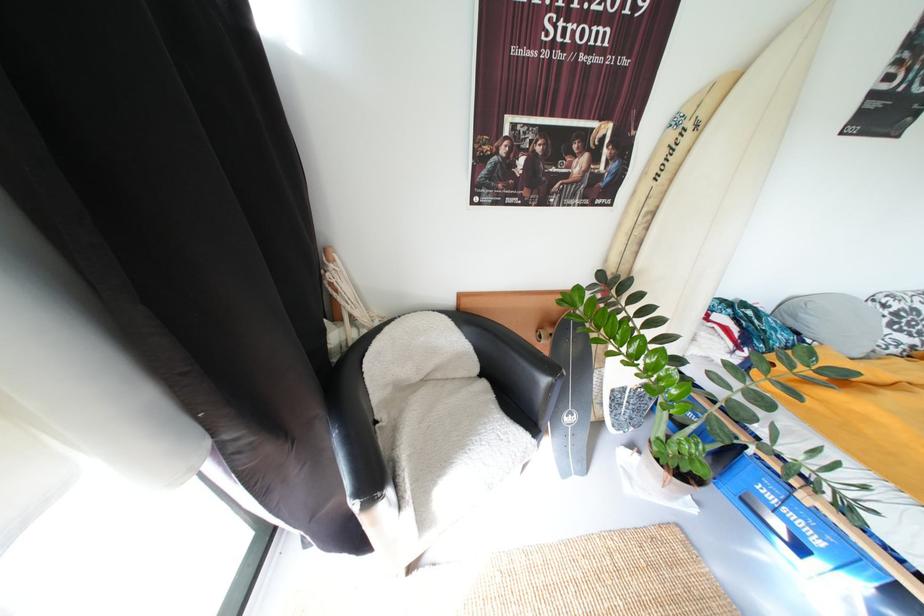
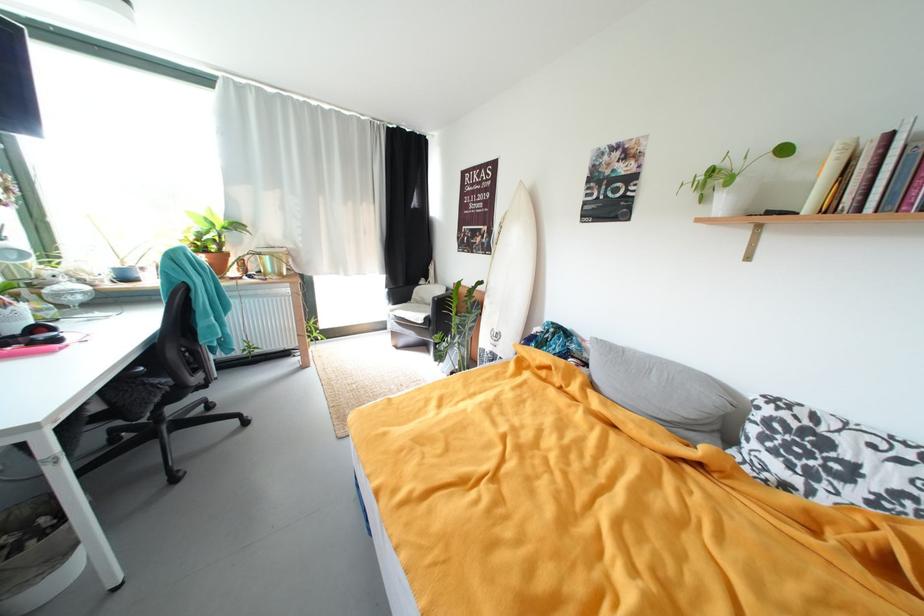
Where in the second image is the point corresponding to [631,148] from the first image?

(497, 235)